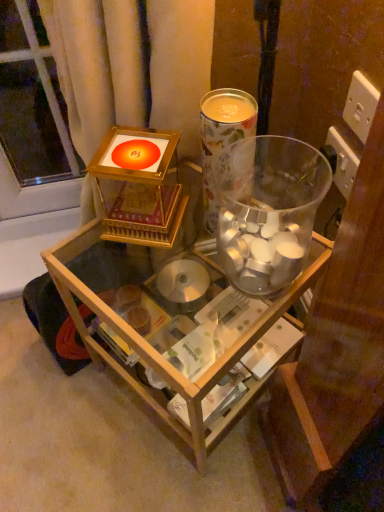
Question: Based on their positions, is floral paper cup at upper center, placed as the second beverage when sorted from bottom to top, located to the left or right of transparent glass vase at center, the first beverage positioned from the bottom?

Choices:
 (A) left
 (B) right

Answer: (A)

Question: In the image, is floral paper cup at upper center, placed as the first beverage when sorted from top to bottom, positioned in front of or behind transparent glass vase at center, the 2th beverage from the top?

Choices:
 (A) front
 (B) behind

Answer: (B)

Question: Which of these objects is positioned closest to the floral paper cup at upper center, placed as the second beverage when sorted from bottom to top?

Choices:
 (A) transparent glass table at center
 (B) transparent glass vase at center, the 2th beverage from the top

Answer: (B)

Question: Which of these objects is positioned closest to the floral paper cup at upper center, placed as the second beverage when sorted from bottom to top?

Choices:
 (A) transparent glass vase at center, the first beverage positioned from the bottom
 (B) transparent glass table at center

Answer: (A)